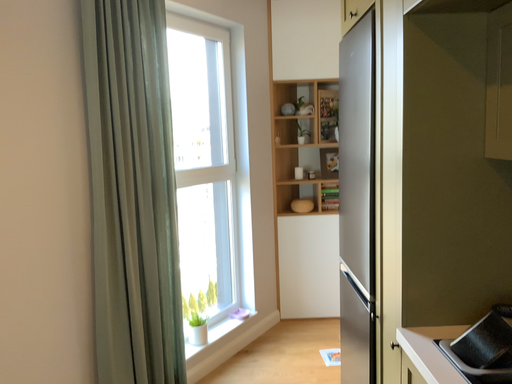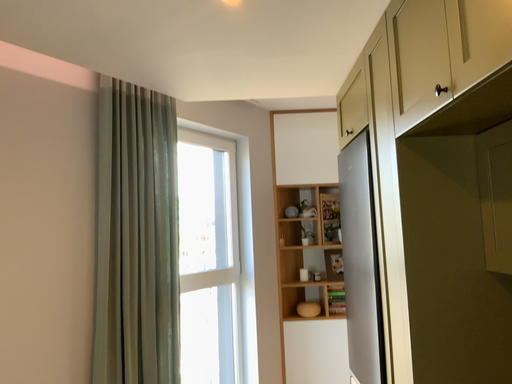
Question: Which way did the camera rotate in the video?

Choices:
 (A) rotated upward
 (B) rotated downward

Answer: (A)